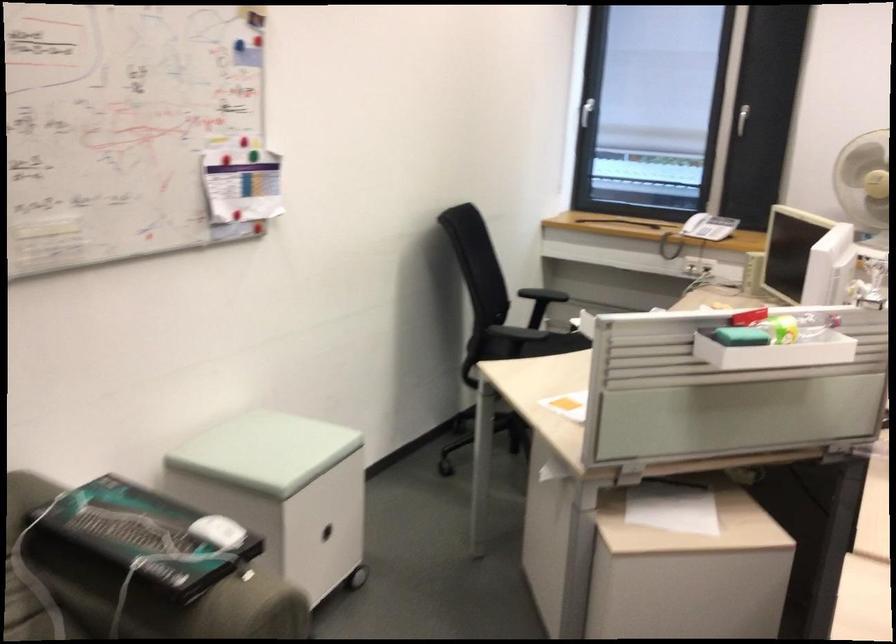
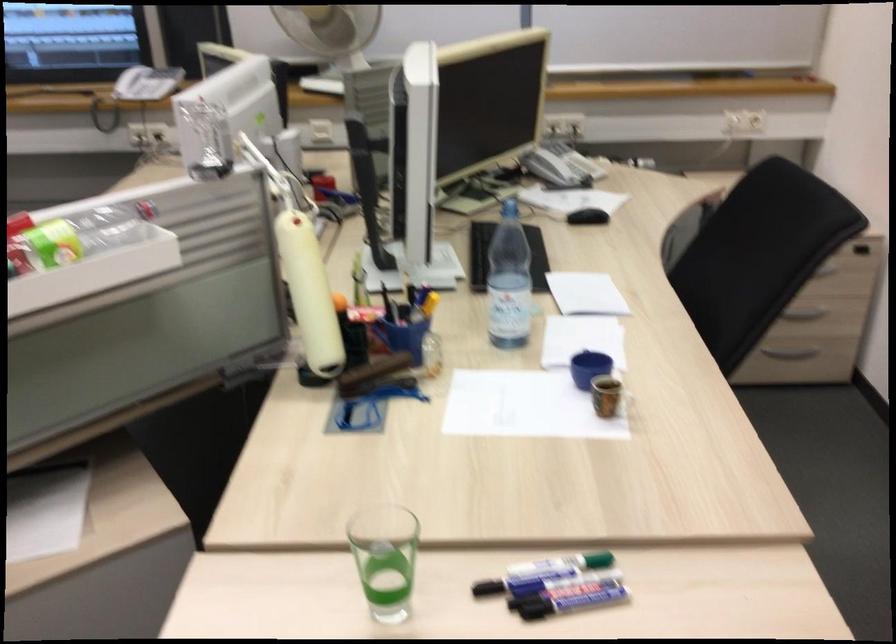
Question: The camera is either moving clockwise (left) or counter-clockwise (right) around the object. The first image is from the beginning of the video and the second image is from the end. Is the camera moving left or right when shooting the video?

Choices:
 (A) Left
 (B) Right

Answer: (A)